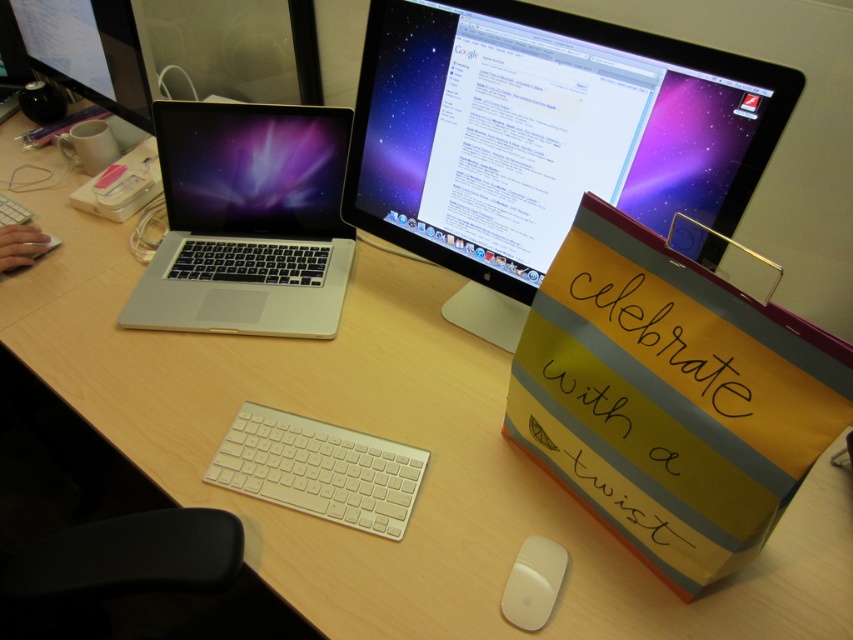
Is matte black monitor at center wider than white matte keyboard at center?

Yes.

Which of these two, matte black monitor at center or white matte keyboard at center, stands shorter?

Standing shorter between the two is white matte keyboard at center.

Describe the element at coordinates (543, 138) in the screenshot. The image size is (853, 640). I see `matte black monitor at center` at that location.

At what (x,y) coordinates should I click in order to perform the action: click on matte black monitor at center. Please return your answer as a coordinate pair (x, y). This screenshot has width=853, height=640. Looking at the image, I should click on (543, 138).

Who is more forward, (450, 172) or (529, 612)?

Positioned in front is point (529, 612).

What do you see at coordinates (543, 138) in the screenshot?
I see `matte black monitor at center` at bounding box center [543, 138].

Which is behind, point (601, 124) or point (524, 604)?

The point (601, 124) is behind.

Where is `matte black monitor at center`? matte black monitor at center is located at coordinates (543, 138).

Between silver metallic laptop at left and white matte keyboard at center, which one appears on the right side from the viewer's perspective?

white matte keyboard at center

Does point (335, 148) come closer to viewer compared to point (398, 518)?

No, it is not.

I want to click on silver metallic laptop at left, so click(x=247, y=221).